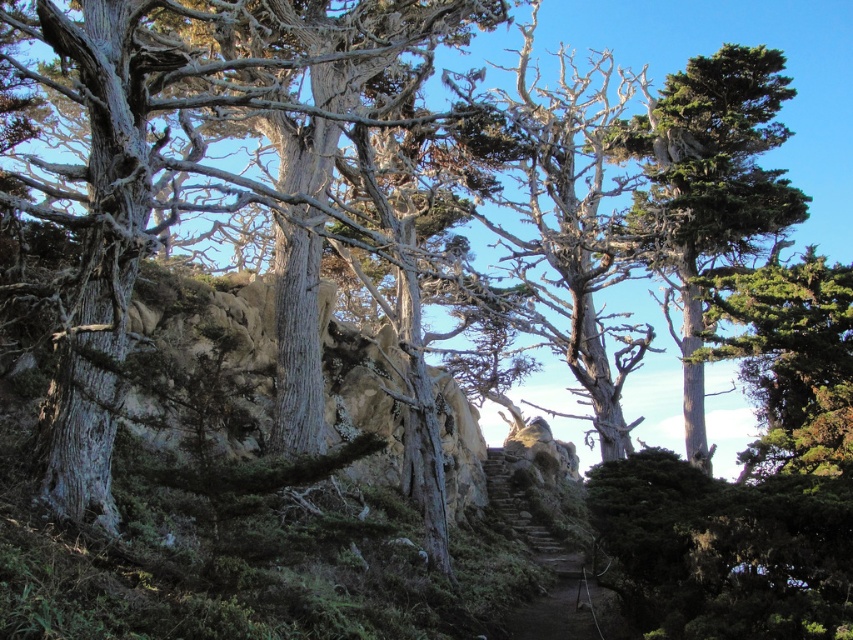
Question: Is green textured tree at upper right positioned before brown stone stairs at center?

Choices:
 (A) no
 (B) yes

Answer: (A)

Question: Considering the relative positions of green textured tree at upper right and brown stone stairs at center in the image provided, where is green textured tree at upper right located with respect to brown stone stairs at center?

Choices:
 (A) below
 (B) above

Answer: (B)

Question: Considering the relative positions of green textured tree at upper right and brown stone stairs at center in the image provided, where is green textured tree at upper right located with respect to brown stone stairs at center?

Choices:
 (A) left
 (B) right

Answer: (B)

Question: Which of the following is the farthest from the observer?

Choices:
 (A) (699, 458)
 (B) (535, 636)

Answer: (A)